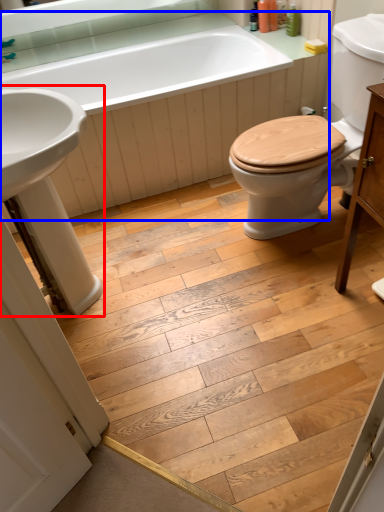
Question: Which point is closer to the camera, sink (highlighted by a red box) or bath (highlighted by a blue box)?

Choices:
 (A) sink
 (B) bath

Answer: (A)